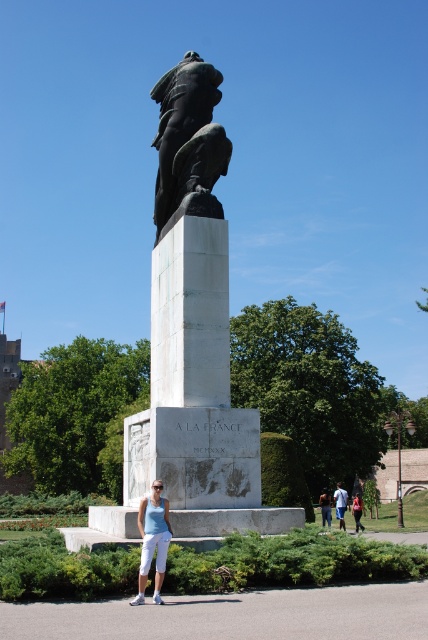
Question: Estimate the real-world distances between objects in this image. Which object is closer to the matte white pants at center?

Choices:
 (A) blue denim jeans at lower center
 (B) black bronze eagle at upper center

Answer: (B)

Question: Can you confirm if black bronze eagle at upper center is positioned below blue denim jeans at lower center?

Choices:
 (A) no
 (B) yes

Answer: (A)

Question: Which point is closer to the camera taking this photo?

Choices:
 (A) (193, 150)
 (B) (335, 497)
 (C) (142, 548)

Answer: (C)

Question: Among these objects, which one is nearest to the camera?

Choices:
 (A) blue denim jeans at lower center
 (B) black bronze eagle at upper center

Answer: (B)

Question: Is black bronze eagle at upper center closer to camera compared to matte white pants at center?

Choices:
 (A) yes
 (B) no

Answer: (B)

Question: Does black bronze eagle at upper center appear under matte white pants at center?

Choices:
 (A) yes
 (B) no

Answer: (B)